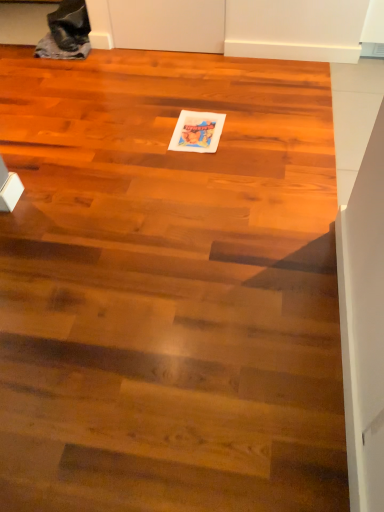
The width and height of the screenshot is (384, 512). In order to click on free space that is to the left of white paper at center in this screenshot , I will do `click(145, 134)`.